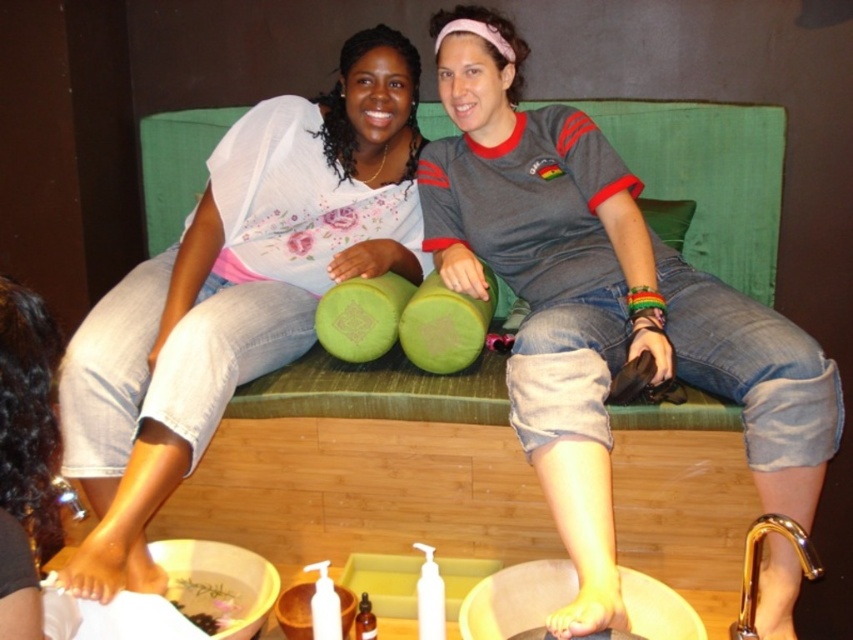
Question: Which of the following is the farthest from the observer?

Choices:
 (A) (672, 227)
 (B) (345, 273)
 (C) (560, 406)

Answer: (A)

Question: Which of the following is the closest to the observer?

Choices:
 (A) (479, 266)
 (B) (277, 129)

Answer: (A)

Question: Can you confirm if matte gray shirt at center is bigger than green fabric pillow at center?

Choices:
 (A) no
 (B) yes

Answer: (B)

Question: Is matte gray shirt at center smaller than matte white blouse at upper left?

Choices:
 (A) no
 (B) yes

Answer: (A)

Question: Is the position of matte gray shirt at center more distant than that of green fabric pillow at center?

Choices:
 (A) yes
 (B) no

Answer: (B)

Question: Which point is closer to the camera?

Choices:
 (A) (654, 221)
 (B) (769, 605)
 (C) (125, 349)

Answer: (B)